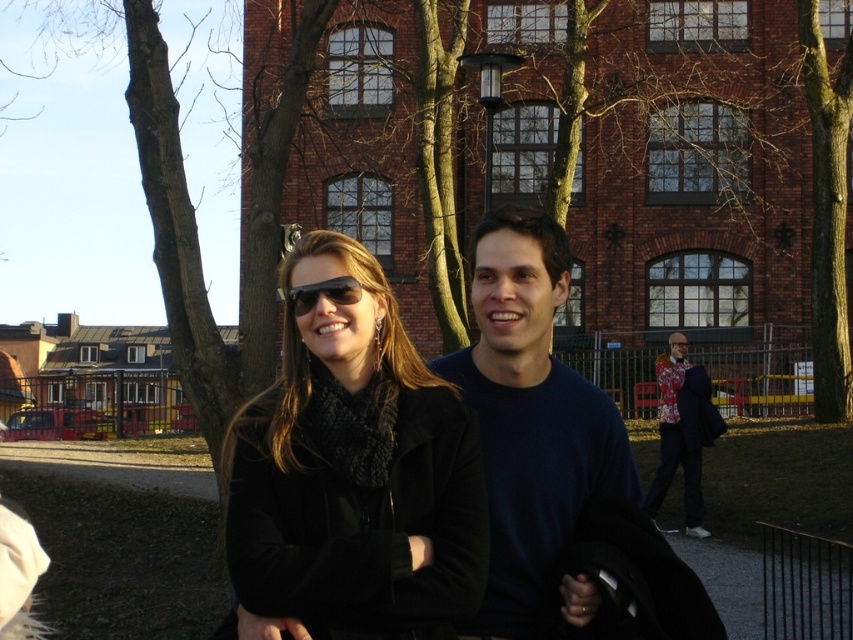
Is dark blue sweater at center smaller than floral fabric jacket at lower right?

Correct, dark blue sweater at center occupies less space than floral fabric jacket at lower right.

Is dark blue sweater at center in front of floral fabric jacket at lower right?

That is True.

Measure the distance between point [541,557] and camera.

Point [541,557] and camera are 39.24 meters apart from each other.

Locate an element on the screen. dark blue sweater at center is located at coordinates (532, 426).

Describe the element at coordinates (532, 426) in the screenshot. I see `dark blue sweater at center` at that location.

Is dark blue sweater at center to the right of matte black sunglasses at center from the viewer's perspective?

Yes, dark blue sweater at center is to the right of matte black sunglasses at center.

Between point (543, 419) and point (320, 292), which one is positioned in front?

Point (320, 292) is in front.

Identify the location of dark blue sweater at center. (532, 426).

Between black matte jacket at center and dark blue sweater at center, which one appears on the left side from the viewer's perspective?

Positioned to the left is black matte jacket at center.

Between black matte jacket at center and dark blue sweater at center, which one is positioned lower?

black matte jacket at center is lower down.

Between point (392, 520) and point (525, 259), which one is positioned in front?

Point (392, 520) is in front.

This screenshot has height=640, width=853. I want to click on black matte jacket at center, so click(x=354, y=470).